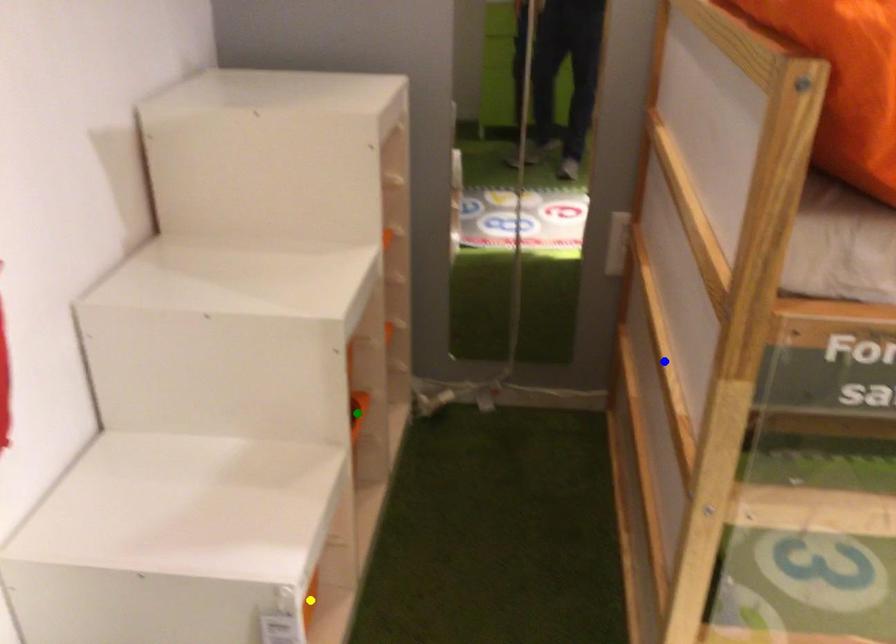
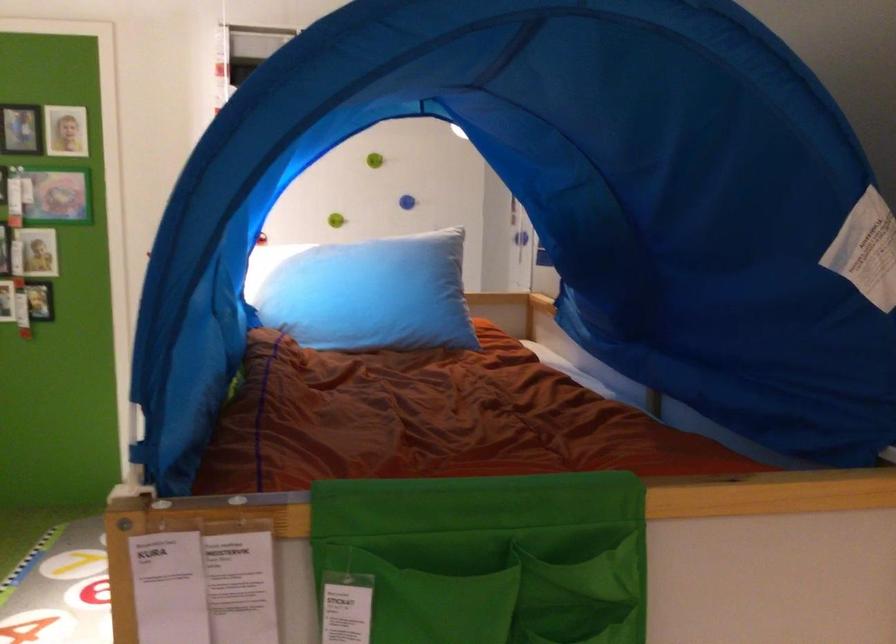
I am providing you with two images of the same scene from different viewpoints. Three points are marked in image1. Which point corresponds to a part or object that is occluded in image2?In image1, three points are marked. Which of them correspond to a part or object that is occluded in image2?Among the three points shown in image1, which one corresponds to a part or object that is no longer visible due to occlusion in image2?

Invisible in image2: yellow point, blue point, green point.